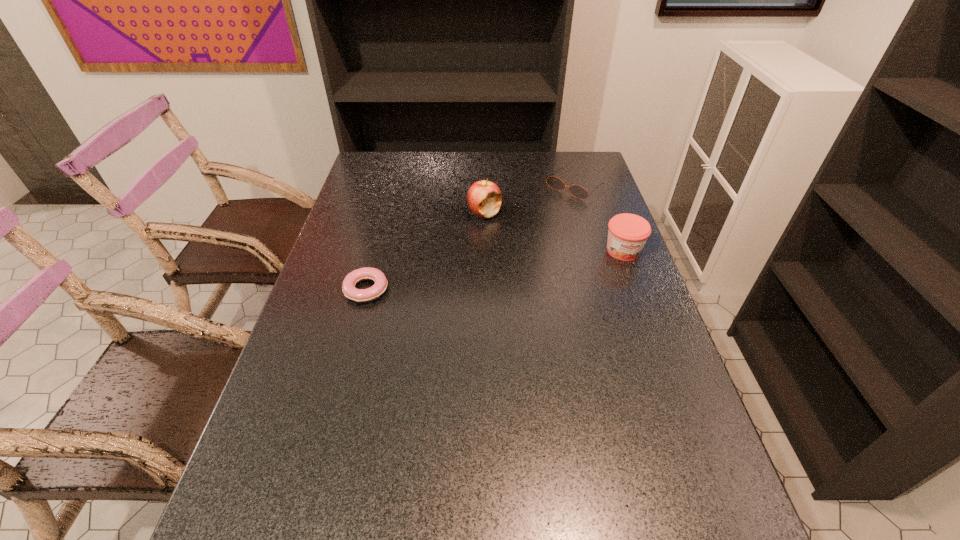
Where is `vacant space in between the second shortest object and the doughnut`? vacant space in between the second shortest object and the doughnut is located at coordinates (470, 238).

Locate an element on the screen. This screenshot has width=960, height=540. vacant area that lies between the third nearest object and the farthest object is located at coordinates (529, 200).

Identify the location of unoccupied area between the doughnut and the second object from left to right. This screenshot has height=540, width=960. (425, 251).

Identify the location of vacant region between the apple and the doughnut. The width and height of the screenshot is (960, 540). (425, 251).

Find the location of `unoccupied position between the jam and the shortest object`. unoccupied position between the jam and the shortest object is located at coordinates (494, 270).

Identify which object is the third closest to the leftmost object. Please provide its 2D coordinates. Your answer should be formatted as a tuple, i.e. [(x, y)], where the tuple contains the x and y coordinates of a point satisfying the conditions above.

[(627, 233)]

Select which object is the third closest to the farthest object. Please provide its 2D coordinates. Your answer should be formatted as a tuple, i.e. [(x, y)], where the tuple contains the x and y coordinates of a point satisfying the conditions above.

[(366, 273)]

Image resolution: width=960 pixels, height=540 pixels. In order to click on free space that satisfies the following two spatial constraints: 1. on the back side of the nearest object; 2. on the right side of the farthest object in this screenshot , I will do `click(394, 186)`.